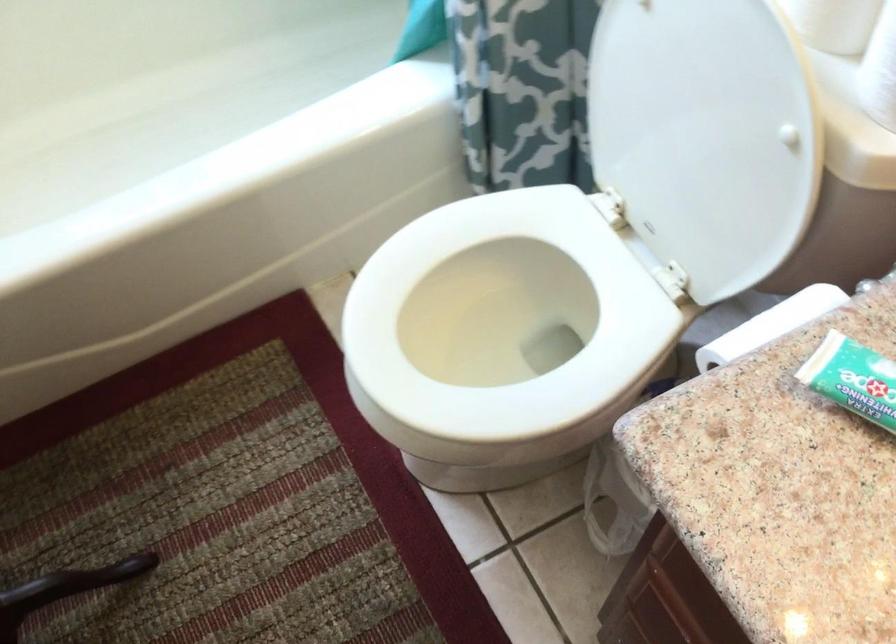
Find where to lower the white toilet seat. Please return your answer as a coordinate pair (x, y).

(504, 334)